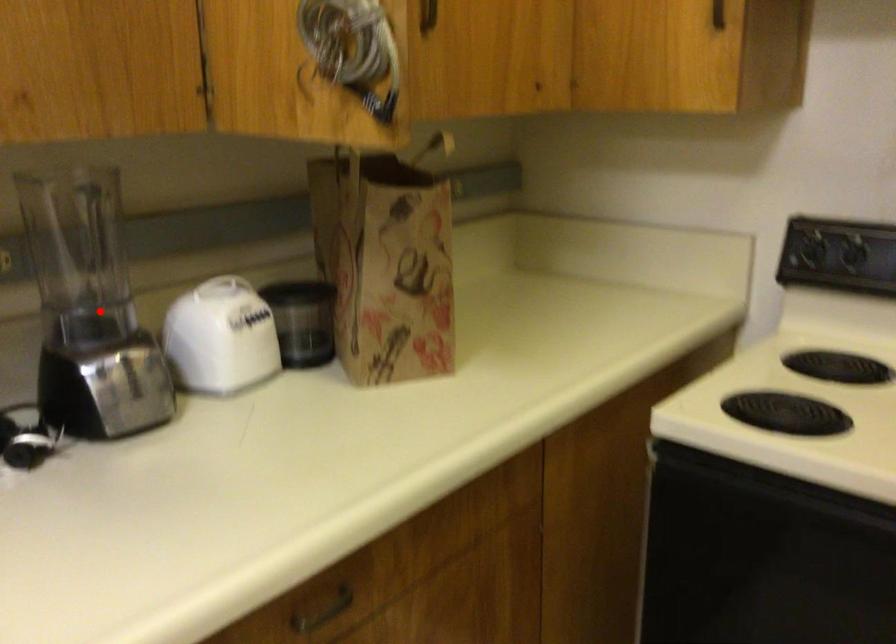
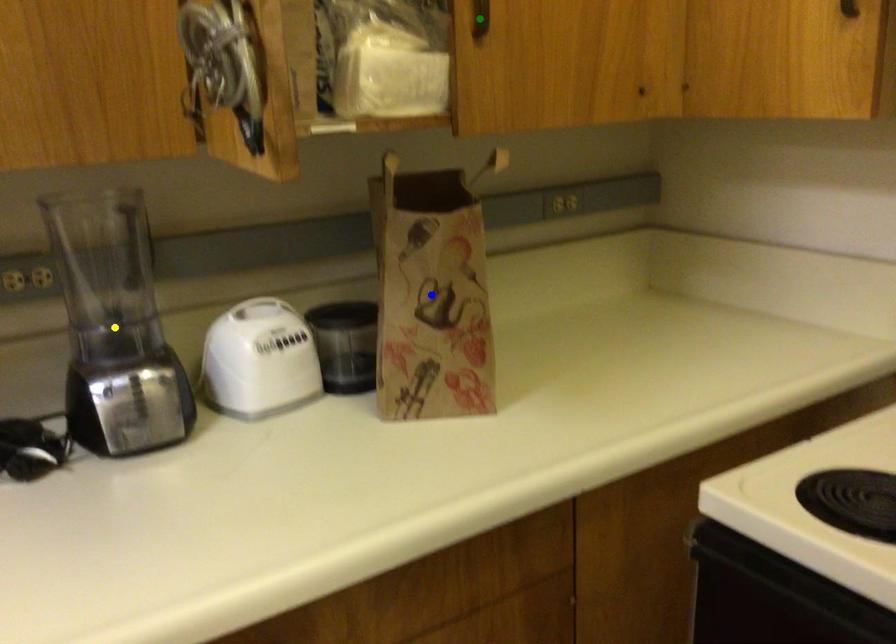
Question: I am providing you with two images of the same scene from different viewpoints. A red point is marked on the first image. You are given multiple points on the second image. Which point in image 2 represents the same 3d spot as the red point in image 1?

Choices:
 (A) green point
 (B) blue point
 (C) yellow point

Answer: (C)